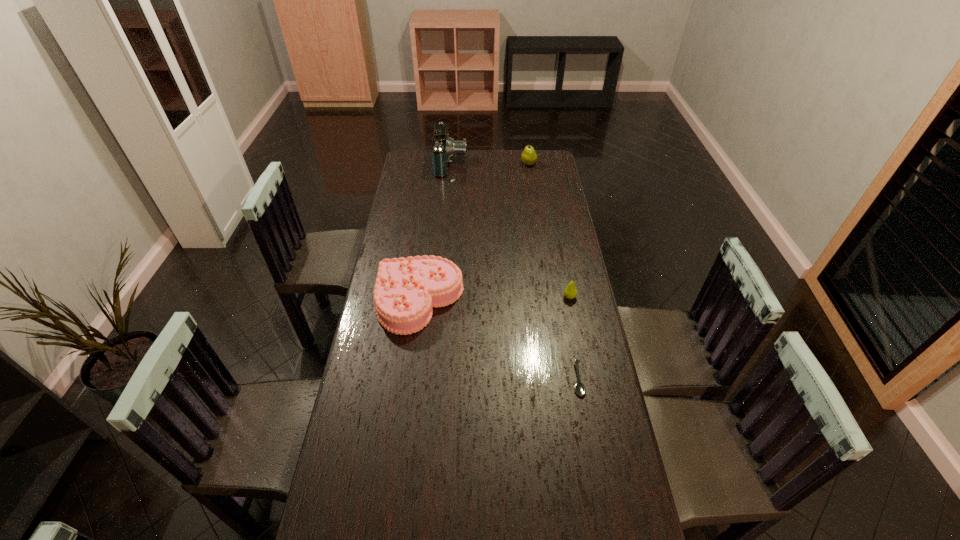
Find the location of `vacant space in between the camcorder and the cake`. vacant space in between the camcorder and the cake is located at coordinates (436, 232).

In order to click on empty location between the shortest object and the cake in this screenshot , I will do coord(499,340).

The image size is (960, 540). I want to click on free space between the nearer pear and the cake, so click(494, 299).

Find the location of `empty location between the shortest object and the farther pear`. empty location between the shortest object and the farther pear is located at coordinates (553, 272).

Where is `object that can be found as the third closest to the cake`? object that can be found as the third closest to the cake is located at coordinates (443, 148).

You are a GUI agent. You are given a task and a screenshot of the screen. Output one action in this format:
    pyautogui.click(x=<x>, y=<y>)
    Task: Click on the object that is the closest to the tallest object
    
    Given the screenshot: What is the action you would take?
    pyautogui.click(x=529, y=157)

Find the location of a particular element. Image resolution: width=960 pixels, height=540 pixels. vacant position in the image that satisfies the following two spatial constraints: 1. on the front-facing side of the shortest object; 2. on the right side of the tallest object is located at coordinates (x=432, y=379).

Image resolution: width=960 pixels, height=540 pixels. I want to click on free spot that satisfies the following two spatial constraints: 1. on the back side of the shortest object; 2. on the front-facing side of the camcorder, so click(540, 164).

The width and height of the screenshot is (960, 540). Identify the location of vacant point that satisfies the following two spatial constraints: 1. on the front-facing side of the soupspoon; 2. on the left side of the tallest object. (432, 379).

This screenshot has width=960, height=540. Identify the location of free space that satisfies the following two spatial constraints: 1. on the front-facing side of the shorter pear; 2. on the right side of the camcorder. (440, 297).